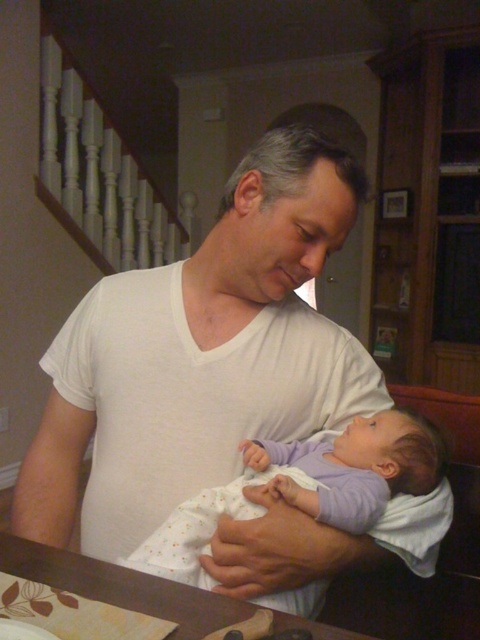
Question: In this image, where is white soft shirt at center located relative to purple soft fabric baby at center?

Choices:
 (A) right
 (B) left

Answer: (B)

Question: Which point is closer to the camera?

Choices:
 (A) (149, 564)
 (B) (191, 294)

Answer: (A)

Question: Which point appears farthest from the camera in this image?

Choices:
 (A) (276, 528)
 (B) (287, 600)

Answer: (B)

Question: Can you confirm if white soft shirt at center is bigger than purple soft fabric baby at center?

Choices:
 (A) yes
 (B) no

Answer: (A)

Question: Which point is farther to the camera?

Choices:
 (A) white soft shirt at center
 (B) purple soft fabric baby at center

Answer: (B)

Question: Can you confirm if white soft shirt at center is bigger than purple soft fabric baby at center?

Choices:
 (A) no
 (B) yes

Answer: (B)